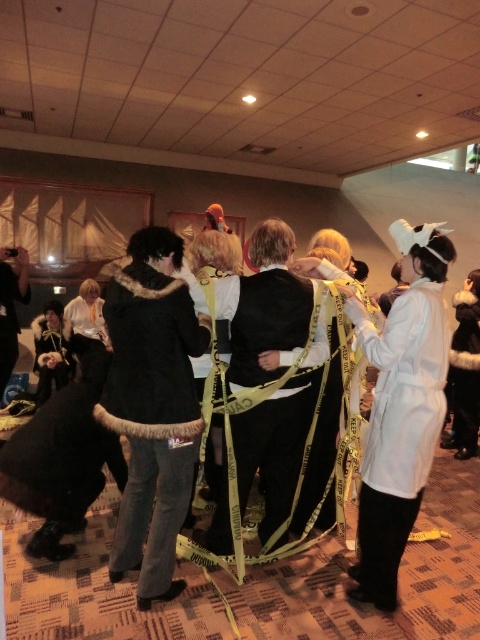
You are a photographer at the event and need to capture a photo where both the white matte coat at center and the velvet black robe at lower left are visible. Given their sizes, which one might appear larger in the photo?

The white matte coat at center appears larger in the photo because it is much taller than the velvet black robe at lower left.

You are organizing a photoshoot and need to position the white matte coat at center and the black satin robe at center in a confined space. Given their sizes, which one would require more room to display properly?

The black satin robe at center requires more room to display properly because it occupies more space than the white matte coat at center.